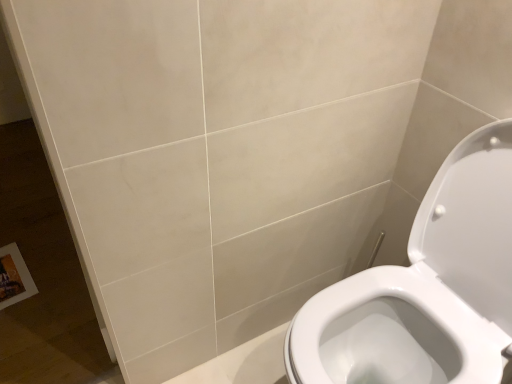
The height and width of the screenshot is (384, 512). Describe the element at coordinates (425, 287) in the screenshot. I see `white glossy toilet at right` at that location.

This screenshot has height=384, width=512. Find the location of `white glossy toilet at right`. white glossy toilet at right is located at coordinates (425, 287).

Where is `white glossy toilet at right`? white glossy toilet at right is located at coordinates (425, 287).